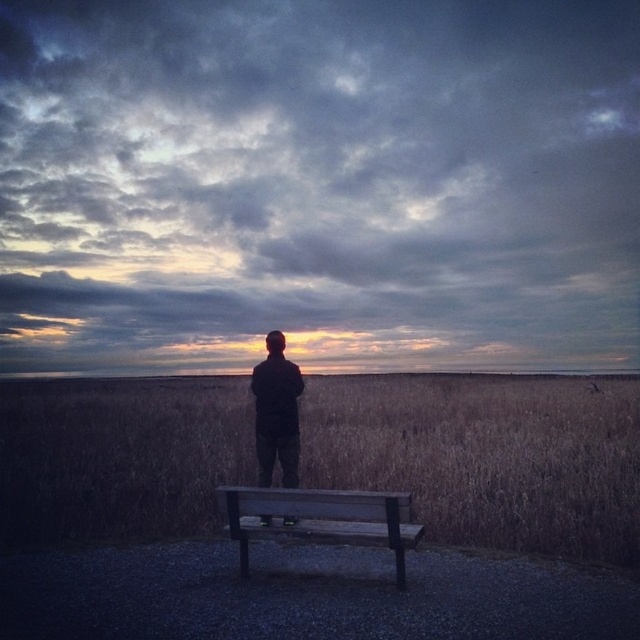
Question: Which point appears farthest from the camera in this image?

Choices:
 (A) (186, 490)
 (B) (257, 454)
 (C) (385, 518)

Answer: (A)

Question: Can you confirm if brown grassy field at center is bigger than wooden bench at lower center?

Choices:
 (A) yes
 (B) no

Answer: (A)

Question: Which of the following is the closest to the observer?

Choices:
 (A) (381, 412)
 (B) (284, 492)
 (C) (278, 333)

Answer: (B)

Question: Is brown grassy field at center above black matte jacket at center?

Choices:
 (A) no
 (B) yes

Answer: (A)

Question: Can you confirm if brown grassy field at center is positioned to the right of black matte jacket at center?

Choices:
 (A) no
 (B) yes

Answer: (B)

Question: Which object is farther from the camera taking this photo?

Choices:
 (A) wooden bench at lower center
 (B) brown grassy field at center
 (C) black matte jacket at center

Answer: (C)